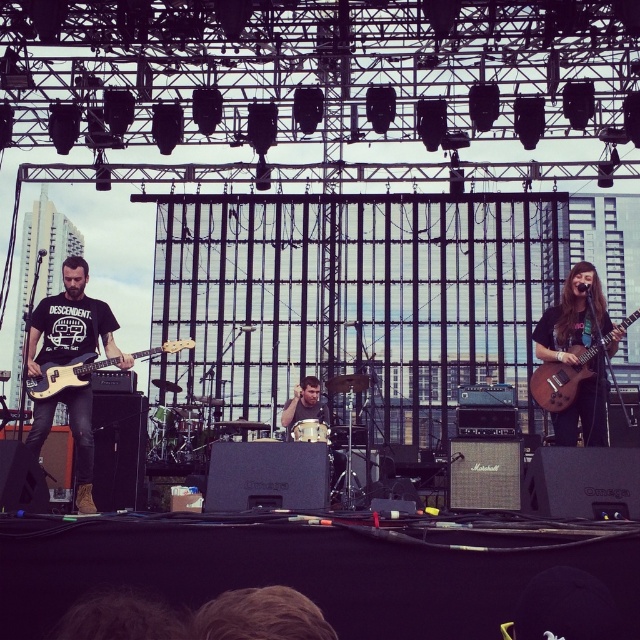
Based on the photo, you are a photographer at the concert venue and need to capture a photo that includes both the matte black bass guitar at left and the smooth drum set at center. Since you want the bass guitar to appear larger in the photo than the drum set, which object should you position closer to the camera?

The matte black bass guitar at left is already closer to the viewer than the smooth drum set at center. To make the bass guitar appear larger, position it even closer to the camera than it currently is.

You are standing in the audience and notice two points on the stage. The first point is at coordinates point (188, 340) and the second is at point (310, 406). Which point is closer to you?

Point (188, 340) is closer to the viewer than point (310, 406).